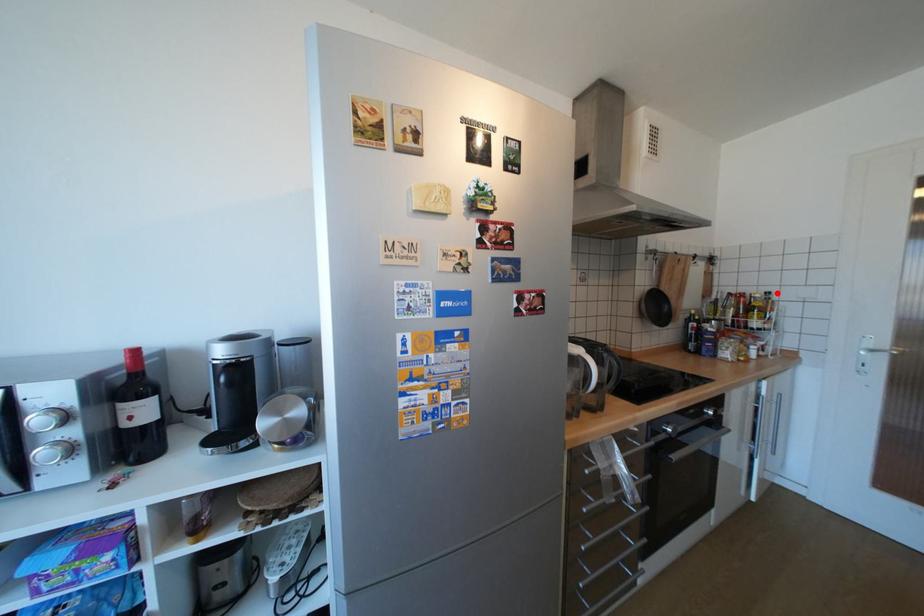
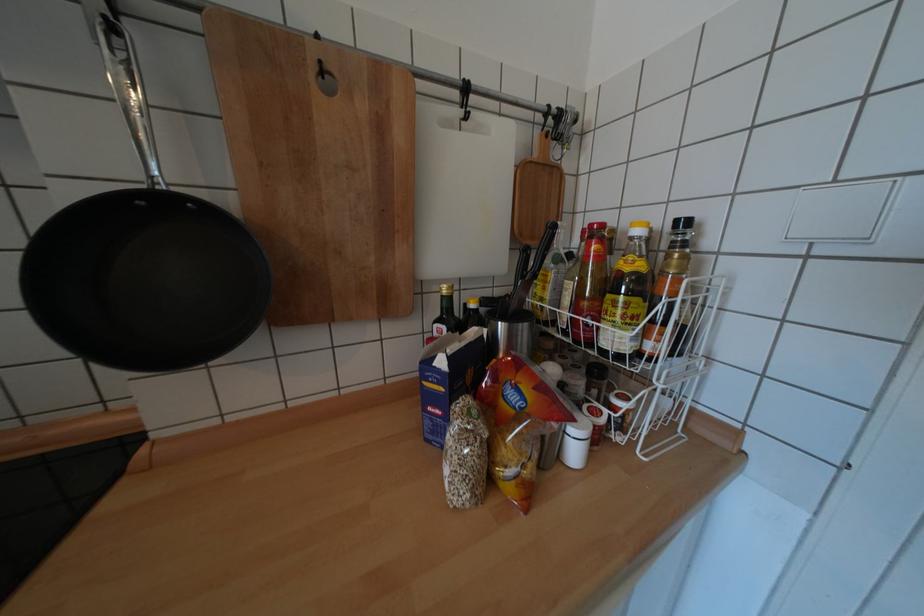
Find the pixel in the second image that matches the highlighted location in the first image.

(694, 224)